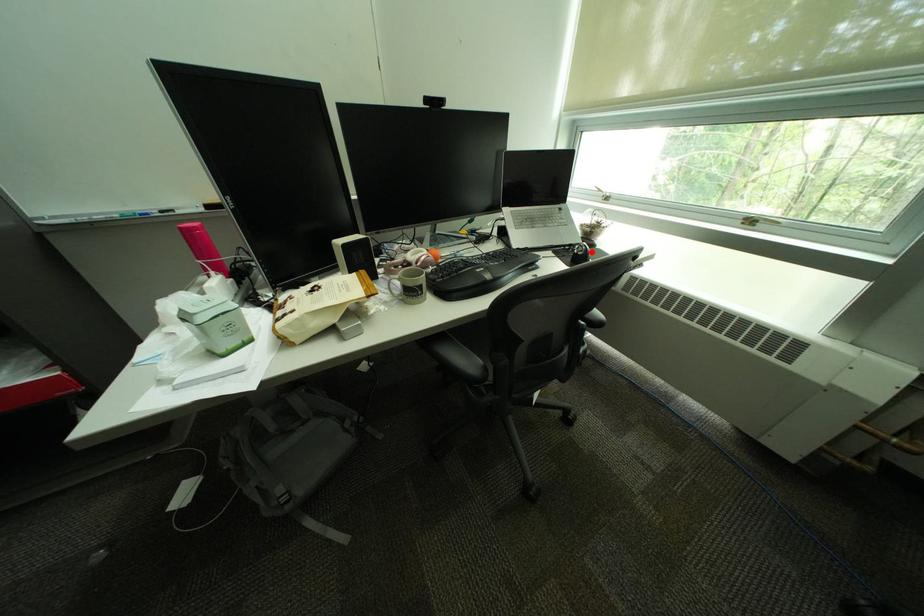
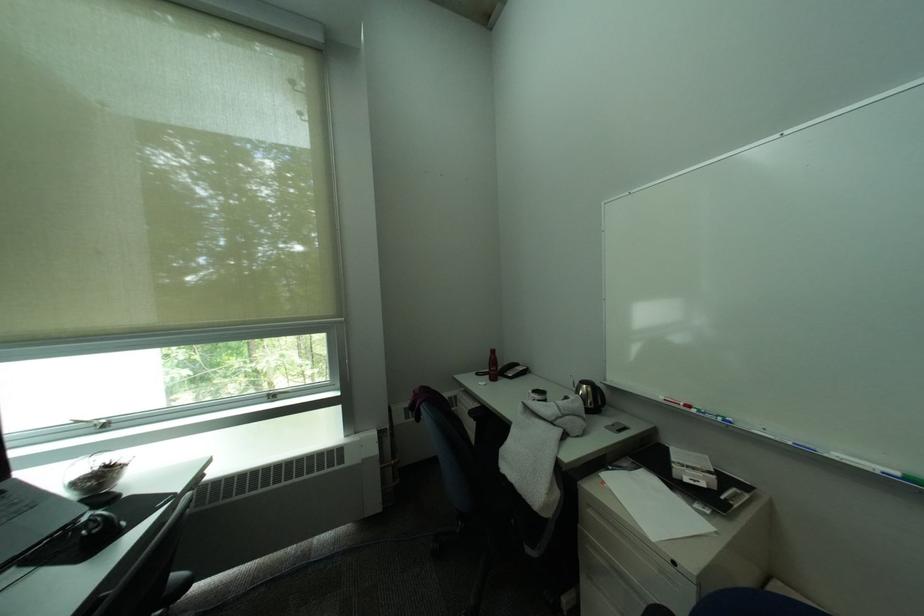
Where in the second image is the point corresponding to the highlighted location from the first image?

(106, 528)